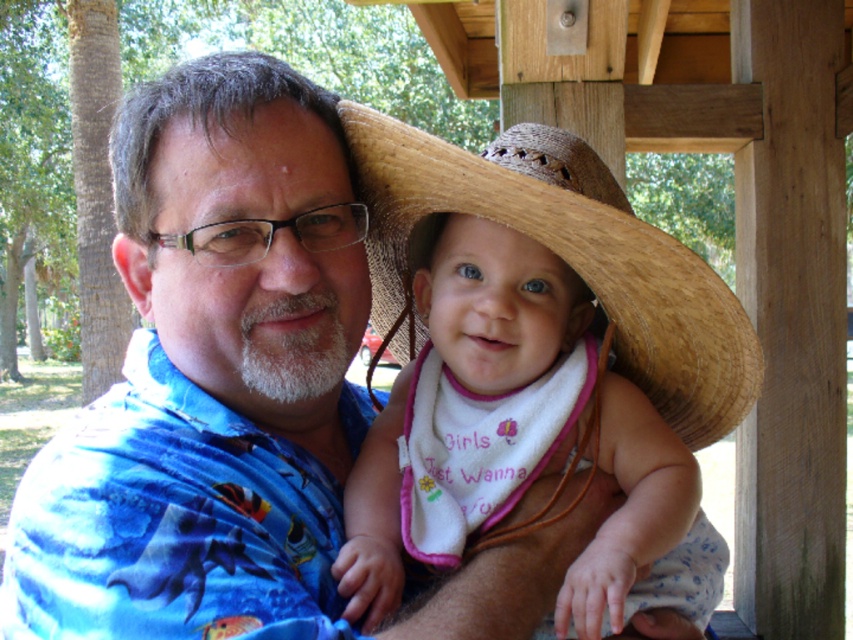
You are a photographer trying to capture a clear shot of the baby in the image. The baby is wearing a white cotton bib at center and a woven straw sombrero at center. Which item is narrower when viewed from the front?

The white cotton bib at center is thinner than the woven straw sombrero at center, so the white cotton bib at center is narrower when viewed from the front.

You are a photographer trying to capture a clear shot of the baby in the image. The baby is wearing a white cotton bib at center and a woven straw sombrero at center. Which item is taller and might block the baby from view?

The white cotton bib at center is much taller as woven straw sombrero at center, so the white cotton bib at center is taller and might block the baby from view.

You are a photographer trying to capture a closeup of the white cotton bib at center. The camera you are using has a minimum focusing distance of 36 inches. Can you take the photo without moving either the camera or the bib?

The white cotton bib at center and camera are 37.32 inches apart from each other. Since the minimum focusing distance is 36 inches, you can take the photo without moving either the camera or the bib because the distance is within the camera s capability.